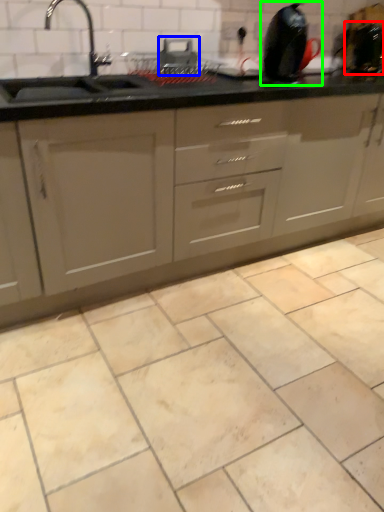
Question: Which object is the farthest from appliance (highlighted by a red box)? Choose among these: appliance (highlighted by a blue box) or appliance (highlighted by a green box).

Choices:
 (A) appliance
 (B) appliance

Answer: (A)